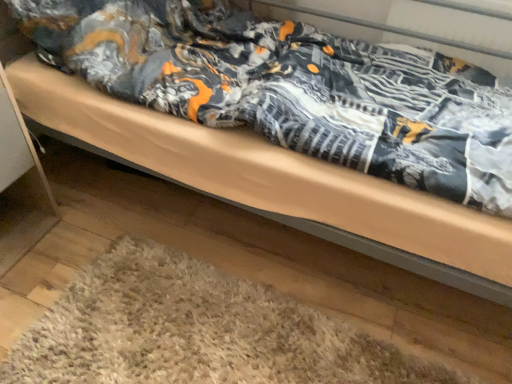
Locate an element on the screen. blank space above beige shaggy rug at lower center (from a real-world perspective) is located at coordinates (192, 333).